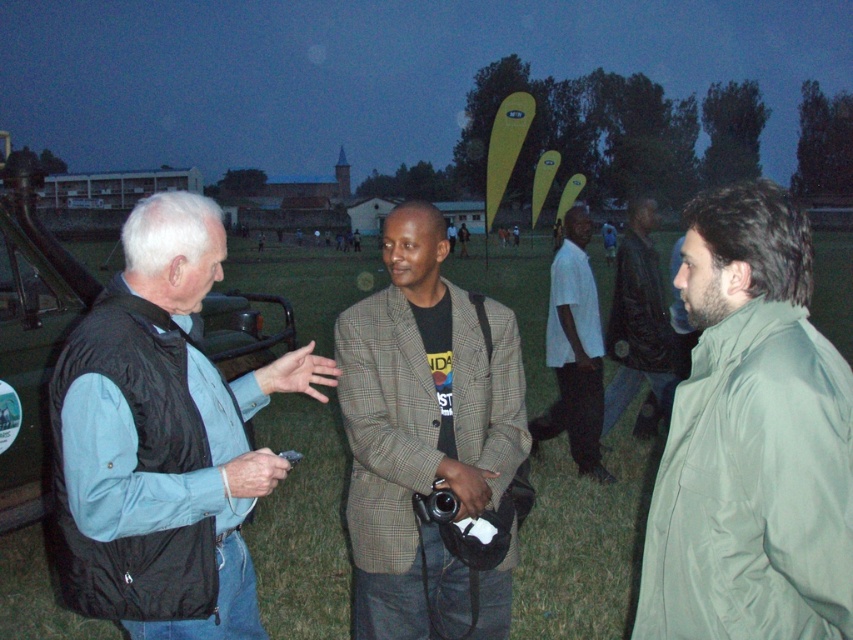
You are a fashion designer observing the two men in the scene. Which clothing item, the plaid fabric blazer at center or the leather jacket at center, is taller in the image?

The plaid fabric blazer at center is taller than the leather jacket at center.